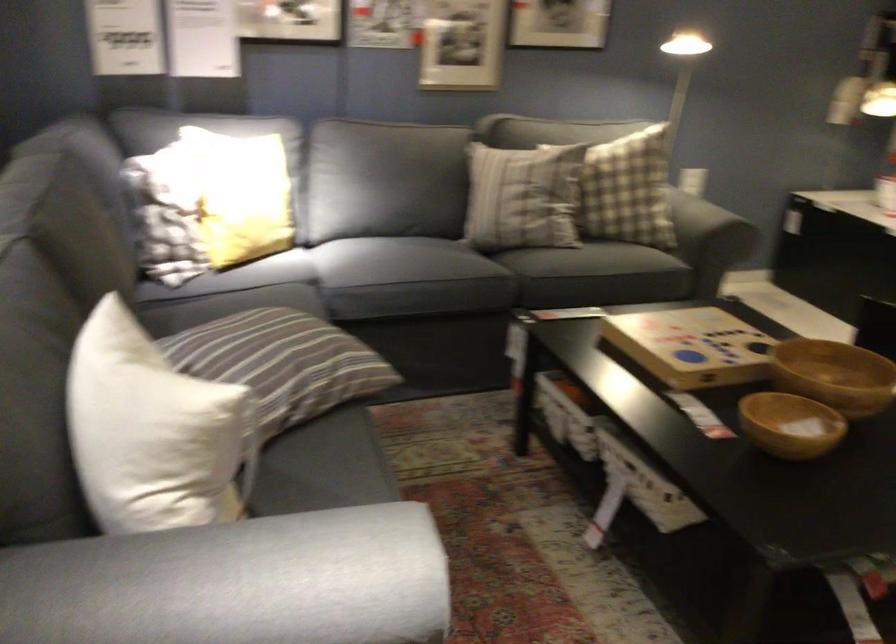
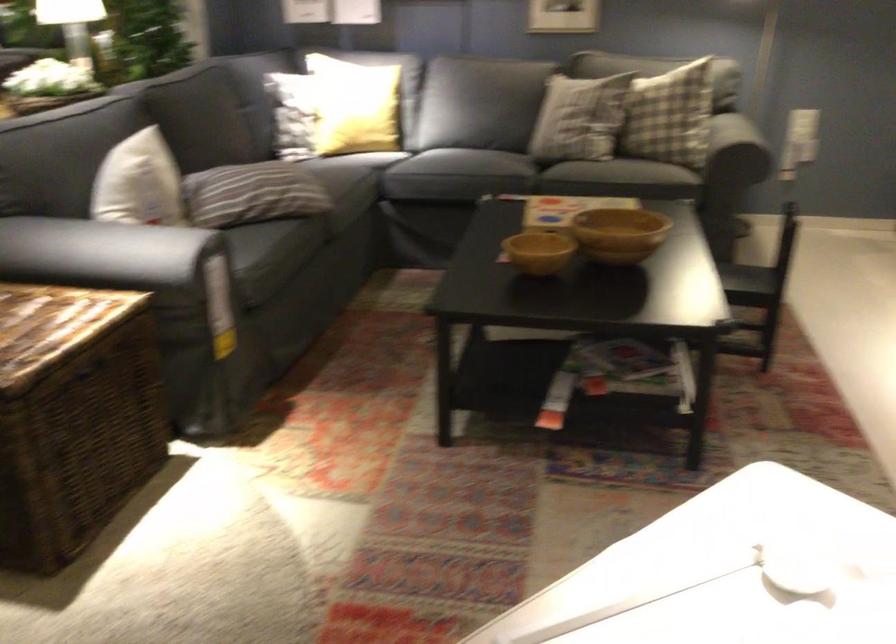
The point at (295, 207) is marked in the first image. Where is the corresponding point in the second image?

(352, 106)